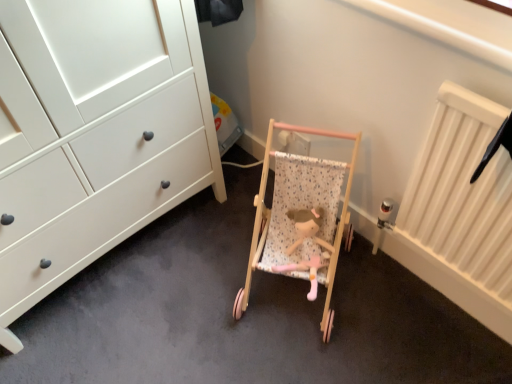
Image resolution: width=512 pixels, height=384 pixels. I want to click on free space to the left of wooden stroller at center, so click(x=187, y=285).